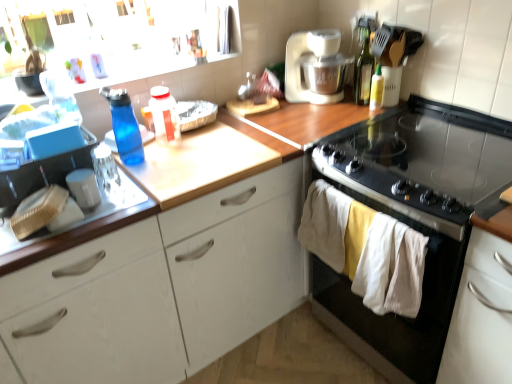
Identify the location of wooden at upper center. (199, 164).

The width and height of the screenshot is (512, 384). What are the coordinates of `black glass gas stove at upper right` in the screenshot? It's located at (428, 160).

What do you see at coordinates (315, 67) in the screenshot? This screenshot has height=384, width=512. I see `white plastic mixer at upper right` at bounding box center [315, 67].

Find the location of `blue translucent bottle at left, the fourth bottle from the right`. blue translucent bottle at left, the fourth bottle from the right is located at coordinates (124, 126).

From a real-world perspective, starting from the green glass bottle at upper right, arranged as the 2th bottle when viewed from the right, which bottle is the 2nd one below it? Please provide its 2D coordinates.

[(376, 90)]

Is green glass bottle at upper right, the 3th bottle in the left-to-right sequence, inside yellow matte bottle at upper right, the 1th bottle in the right-to-left sequence?

Actually, green glass bottle at upper right, the 3th bottle in the left-to-right sequence, is outside yellow matte bottle at upper right, the 1th bottle in the right-to-left sequence.

Does yellow matte bottle at upper right, acting as the 4th bottle starting from the left, have a lesser height compared to green glass bottle at upper right, arranged as the 2th bottle when viewed from the right?

Indeed, yellow matte bottle at upper right, acting as the 4th bottle starting from the left, has a lesser height compared to green glass bottle at upper right, arranged as the 2th bottle when viewed from the right.

Can you confirm if wooden at upper center is positioned to the right of blue translucent bottle at left, the 1th bottle in the left-to-right sequence?

Correct, you'll find wooden at upper center to the right of blue translucent bottle at left, the 1th bottle in the left-to-right sequence.

Is blue translucent bottle at left, the fourth bottle from the right, completely or partially inside wooden at upper center?

Definitely not — blue translucent bottle at left, the fourth bottle from the right, is not inside wooden at upper center.

Can you tell me how much wooden at upper center and blue translucent bottle at left, the 1th bottle in the left-to-right sequence, differ in facing direction?

The angle between the facing direction of wooden at upper center and the facing direction of blue translucent bottle at left, the 1th bottle in the left-to-right sequence, is 1.44 degrees.

From the picture: Looking at the image, does wooden at upper center seem bigger or smaller compared to blue translucent bottle at left, the fourth bottle from the right?

Clearly, wooden at upper center is larger in size than blue translucent bottle at left, the fourth bottle from the right.

Are black glass stove at right and blue translucent bottle at left, the 1th bottle in the left-to-right sequence, located far from each other?

No, black glass stove at right is in close proximity to blue translucent bottle at left, the 1th bottle in the left-to-right sequence.

Is point (372, 342) closer to camera compared to point (140, 160)?

That is False.

Considering the positions of objects black glass stove at right and blue translucent bottle at left, the 1th bottle in the left-to-right sequence, in the image provided, who is more to the right, black glass stove at right or blue translucent bottle at left, the 1th bottle in the left-to-right sequence,?

Positioned to the right is black glass stove at right.

Is the position of black glass stove at right more distant than that of blue translucent bottle at left, the 1th bottle in the left-to-right sequence?

No, black glass stove at right is closer to the camera.

In the scene shown: From the image's perspective, who appears lower, translucent plastic bottle at center, the 3th bottle from the right, or blue translucent bottle at left, the fourth bottle from the right?

blue translucent bottle at left, the fourth bottle from the right, is shown below in the image.

From the picture: Is translucent plastic bottle at center, the 3th bottle from the right, aimed at blue translucent bottle at left, the fourth bottle from the right?

No, translucent plastic bottle at center, the 3th bottle from the right, does not turn towards blue translucent bottle at left, the fourth bottle from the right.

How different are the orientations of translucent plastic bottle at center, the 3th bottle from the right, and blue translucent bottle at left, the fourth bottle from the right, in degrees?

6.72e-05 degrees.

Between translucent plastic bottle at center, the 2th bottle positioned from the left, and blue translucent bottle at left, the 1th bottle in the left-to-right sequence, which one has larger size?

Bigger between the two is blue translucent bottle at left, the 1th bottle in the left-to-right sequence.

Is white plastic mixer at upper right to the right of blue translucent bottle at left, the fourth bottle from the right, from the viewer's perspective?

Indeed, white plastic mixer at upper right is positioned on the right side of blue translucent bottle at left, the fourth bottle from the right.

Can we say white plastic mixer at upper right lies outside blue translucent bottle at left, the fourth bottle from the right?

Yes, white plastic mixer at upper right is outside of blue translucent bottle at left, the fourth bottle from the right.

Which object is wider, white plastic mixer at upper right or blue translucent bottle at left, the 1th bottle in the left-to-right sequence?

white plastic mixer at upper right is wider.

Are blue translucent bottle at left, the fourth bottle from the right, and black glass stove at right making contact?

A: blue translucent bottle at left, the fourth bottle from the right, is not next to black glass stove at right, and they're not touching.

Could black glass stove at right be considered to be inside blue translucent bottle at left, the 1th bottle in the left-to-right sequence?

No, black glass stove at right is not inside blue translucent bottle at left, the 1th bottle in the left-to-right sequence.

Which is more to the right, blue translucent bottle at left, the 1th bottle in the left-to-right sequence, or black glass stove at right?

From the viewer's perspective, black glass stove at right appears more on the right side.

Looking at their sizes, would you say wooden at upper center is wider or thinner than green glass bottle at upper right, the 3th bottle in the left-to-right sequence?

Considering their sizes, wooden at upper center looks broader than green glass bottle at upper right, the 3th bottle in the left-to-right sequence.

Can you tell me how much wooden at upper center and green glass bottle at upper right, arranged as the 2th bottle when viewed from the right, differ in facing direction?

80.7 degrees.

From the image's perspective, would you say wooden at upper center is positioned over green glass bottle at upper right, arranged as the 2th bottle when viewed from the right?

Actually, wooden at upper center appears below green glass bottle at upper right, arranged as the 2th bottle when viewed from the right, in the image.

How much distance is there between wooden at upper center and green glass bottle at upper right, arranged as the 2th bottle when viewed from the right?

A distance of 30.12 inches exists between wooden at upper center and green glass bottle at upper right, arranged as the 2th bottle when viewed from the right.

The width and height of the screenshot is (512, 384). There is a green glass bottle at upper right, arranged as the 2th bottle when viewed from the right. Find the location of `the 1st bottle below it (from the image's perspective)`. the 1st bottle below it (from the image's perspective) is located at coordinates (376, 90).

At what (x,y) coordinates should I click in order to perform the action: click on counter top that appears on the right of blue translucent bottle at left, the 1th bottle in the left-to-right sequence. Please return your answer as a coordinate pair (x, y). Image resolution: width=512 pixels, height=384 pixels. Looking at the image, I should click on (199, 164).

Based on their spatial positions, is black glass stove at right or white wood cabinet at lower right, the 1th cabinetry when ordered from right to left, further from yellow matte bottle at upper right, acting as the 4th bottle starting from the left?

white wood cabinet at lower right, the 1th cabinetry when ordered from right to left, is further to yellow matte bottle at upper right, acting as the 4th bottle starting from the left.

From the image, which object appears to be farther from black glass stove at right, black glass gas stove at upper right or white plastic mixer at upper right?

white plastic mixer at upper right lies further to black glass stove at right than the other object.

From the image, which object appears to be nearer to white wood cabinet at center, the 1th cabinetry in the left-to-right sequence, black glass stove at right or white plastic mixer at upper right?

black glass stove at right is positioned closer to the anchor white wood cabinet at center, the 1th cabinetry in the left-to-right sequence.

Estimate the real-world distances between objects in this image. Which object is closer to green glass bottle at upper right, arranged as the 2th bottle when viewed from the right, translucent plastic bottle at center, the 2th bottle positioned from the left, or black glass gas stove at upper right?

The object closer to green glass bottle at upper right, arranged as the 2th bottle when viewed from the right, is black glass gas stove at upper right.

Looking at the image, which one is located further to white wood cabinet at center, the 1th cabinetry in the left-to-right sequence, black glass stove at right or black glass gas stove at upper right?

black glass gas stove at upper right lies further to white wood cabinet at center, the 1th cabinetry in the left-to-right sequence, than the other object.

Looking at the image, which one is located closer to white wood cabinet at lower right, acting as the 2th cabinetry starting from the left, white wood cabinet at center, the 1th cabinetry in the left-to-right sequence, or wooden at upper center?

wooden at upper center is closer to white wood cabinet at lower right, acting as the 2th cabinetry starting from the left.

Consider the image. Estimate the real-world distances between objects in this image. Which object is closer to translucent plastic bottle at center, the 3th bottle from the right, white wood cabinet at center, which is the second cabinetry from right to left, or yellow matte bottle at upper right, the 1th bottle in the right-to-left sequence?

Based on the image, white wood cabinet at center, which is the second cabinetry from right to left, appears to be nearer to translucent plastic bottle at center, the 3th bottle from the right.

Considering their positions, is black glass gas stove at upper right positioned further to white wood cabinet at lower right, acting as the 2th cabinetry starting from the left, than yellow matte bottle at upper right, acting as the 4th bottle starting from the left?

Among the two, yellow matte bottle at upper right, acting as the 4th bottle starting from the left, is located further to white wood cabinet at lower right, acting as the 2th cabinetry starting from the left.

In order to click on kitchen appliance situated between translucent plastic bottle at center, the 2th bottle positioned from the left, and white wood cabinet at lower right, the 1th cabinetry when ordered from right to left, from left to right in this screenshot , I will do `click(315, 67)`.

Locate an element on the screen. counter top between translucent plastic bottle at center, the 3th bottle from the right, and green glass bottle at upper right, the 3th bottle in the left-to-right sequence, in the horizontal direction is located at coordinates (199, 164).

Identify the location of oven between yellow matte bottle at upper right, the 1th bottle in the right-to-left sequence, and white wood cabinet at lower right, acting as the 2th cabinetry starting from the left, in the up-down direction. (396, 315).

Image resolution: width=512 pixels, height=384 pixels. I want to click on counter top located between translucent plastic bottle at center, the 3th bottle from the right, and white wood cabinet at lower right, acting as the 2th cabinetry starting from the left, in the left-right direction, so click(x=199, y=164).